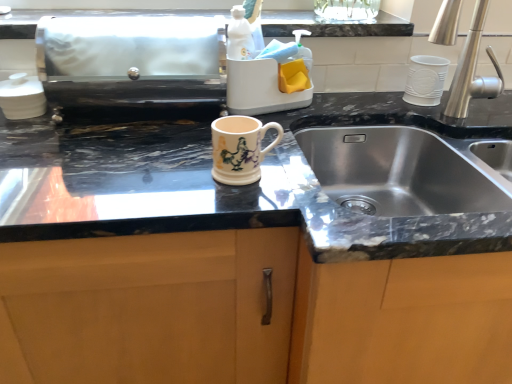
Locate an element on the screen. Image resolution: width=512 pixels, height=384 pixels. vacant position to the left of matte ceramic mug at center is located at coordinates (168, 184).